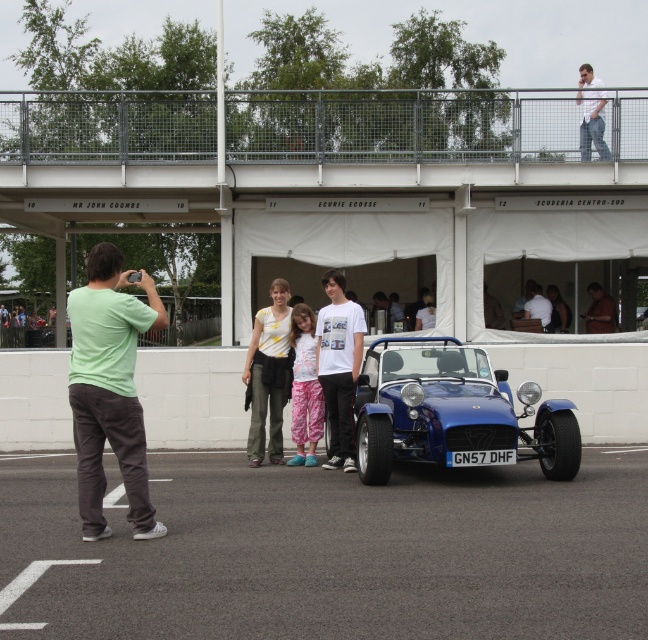
Does point (354, 538) lie in front of point (301, 385)?

Yes, point (354, 538) is closer to viewer.

Where is `black asphalt at lower center`? The height and width of the screenshot is (640, 648). black asphalt at lower center is located at coordinates (336, 552).

Which is in front, point (41, 602) or point (310, 456)?

Positioned in front is point (41, 602).

This screenshot has width=648, height=640. Identify the location of black asphalt at lower center. (336, 552).

Between white cotton t-shirt at center and yellow printed shirt at center, which one is positioned lower?

yellow printed shirt at center

Consider the image. Does white cotton t-shirt at center have a greater width compared to yellow printed shirt at center?

Incorrect, white cotton t-shirt at center's width does not surpass yellow printed shirt at center's.

In order to click on white cotton t-shirt at center in this screenshot , I will do `click(338, 365)`.

Which of these two, green cotton shirt at left or light blue shirt at upper right, stands shorter?

With less height is green cotton shirt at left.

Which is more to the left, green cotton shirt at left or light blue shirt at upper right?

From the viewer's perspective, green cotton shirt at left appears more on the left side.

Locate an element on the screen. green cotton shirt at left is located at coordinates (110, 388).